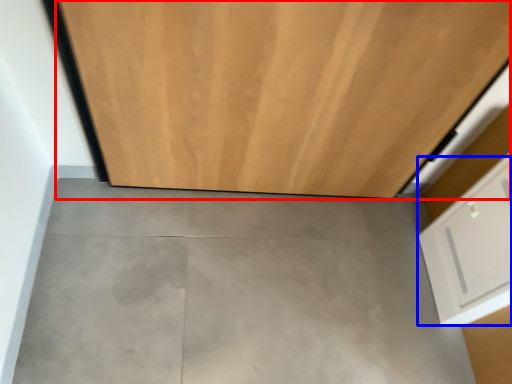
Question: Which object appears farthest to the camera in this image, door (highlighted by a red box) or drawer (highlighted by a blue box)?

Choices:
 (A) door
 (B) drawer

Answer: (B)